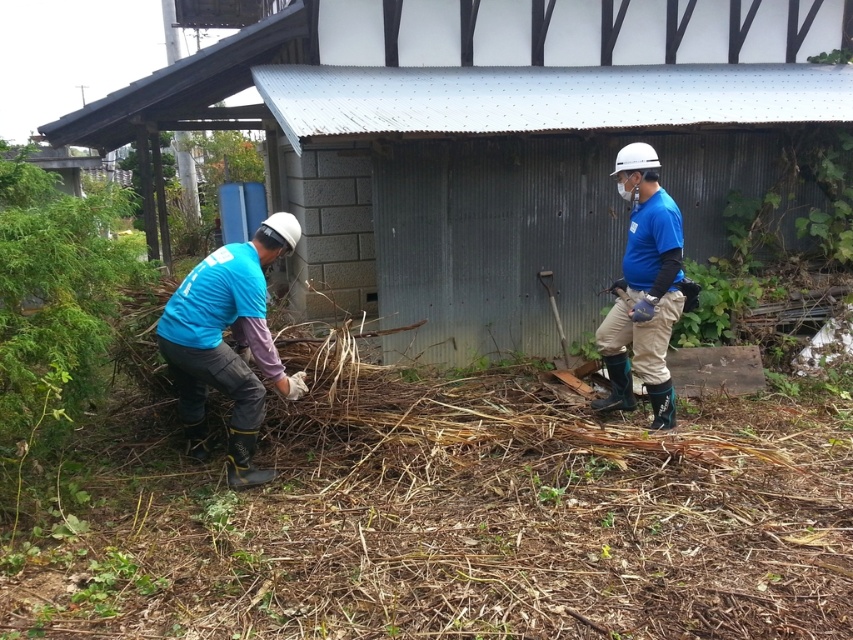
You are standing at the point marked by the coordinates point [491,141] in the image. What object is located directly in front of you?

The point [491,141] marks the blue fabric hut at center, so the blue fabric hut at center is directly in front of you.

You are a photographer trying to capture both the matte blue shirt at left and the blue fabric shirt at right in the same frame. Which shirt should you focus on first to ensure both are in the frame?

The matte blue shirt at left is shorter than the blue fabric shirt at right, so you should focus on the blue fabric shirt at right first to ensure both are in the frame.

You are a hiker who needs to decide whether to take shelter under the blue fabric hut at center or sit under the blue fabric shirt at right. Which option provides more vertical space?

The blue fabric hut at center is much taller than the blue fabric shirt at right, so it provides more vertical space for shelter.